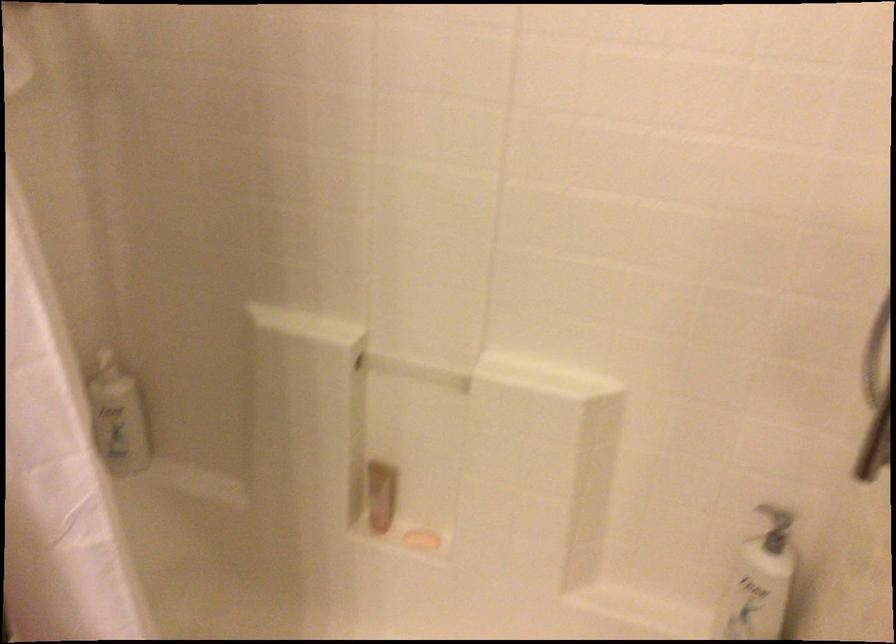
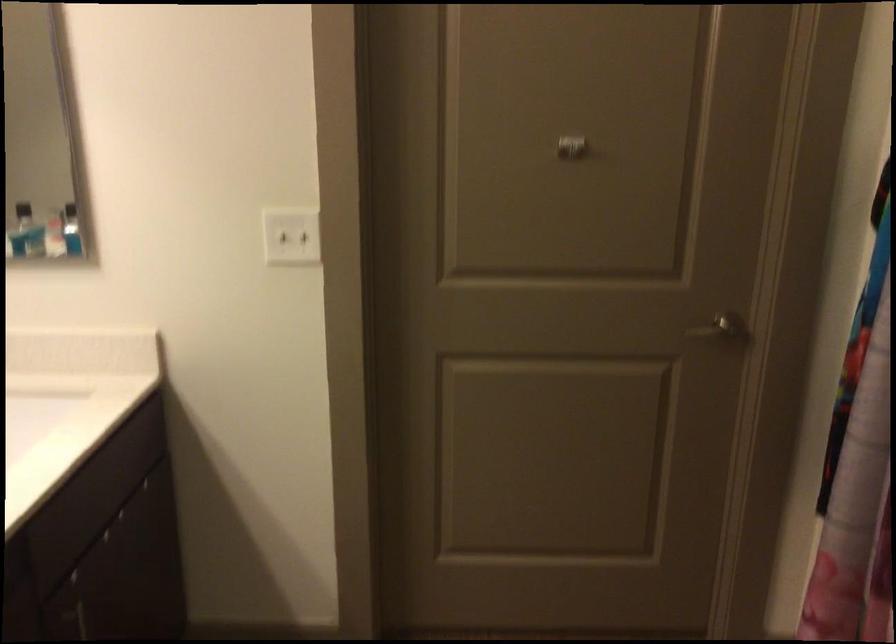
Question: The camera is either moving clockwise (left) or counter-clockwise (right) around the object. The first image is from the beginning of the video and the second image is from the end. Is the camera moving left or right when shooting the video?

Choices:
 (A) Left
 (B) Right

Answer: (B)